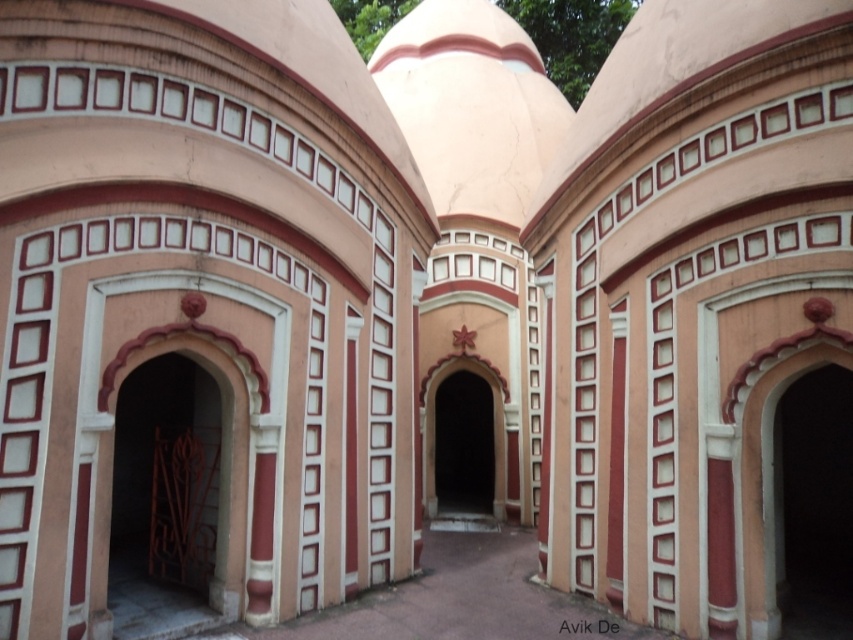
Between point (120, 388) and point (485, 481), which one is positioned in front?

Point (120, 388) is more forward.

Is point (163, 499) positioned in front of point (450, 412)?

Yes, point (163, 499) is in front of point (450, 412).

Where is `polished metal gate at left`? polished metal gate at left is located at coordinates (166, 500).

Does polished metal gate at left have a greater width compared to pink stone archway at right?

Correct, the width of polished metal gate at left exceeds that of pink stone archway at right.

Between polished metal gate at left and pink stone archway at right, which one is positioned lower?

Positioned lower is pink stone archway at right.

The image size is (853, 640). Identify the location of polished metal gate at left. pyautogui.click(x=166, y=500).

What do you see at coordinates (813, 504) in the screenshot? I see `pink stone archway at right` at bounding box center [813, 504].

Can you confirm if pink stone archway at right is bigger than smooth pink archway at center?

No, pink stone archway at right is not bigger than smooth pink archway at center.

Is point (838, 573) in front of point (465, 461)?

That is True.

You are a GUI agent. You are given a task and a screenshot of the screen. Output one action in this format:
    pyautogui.click(x=<x>, y=<y>)
    Task: Click on the pink stone archway at right
    
    Given the screenshot: What is the action you would take?
    pyautogui.click(x=813, y=504)